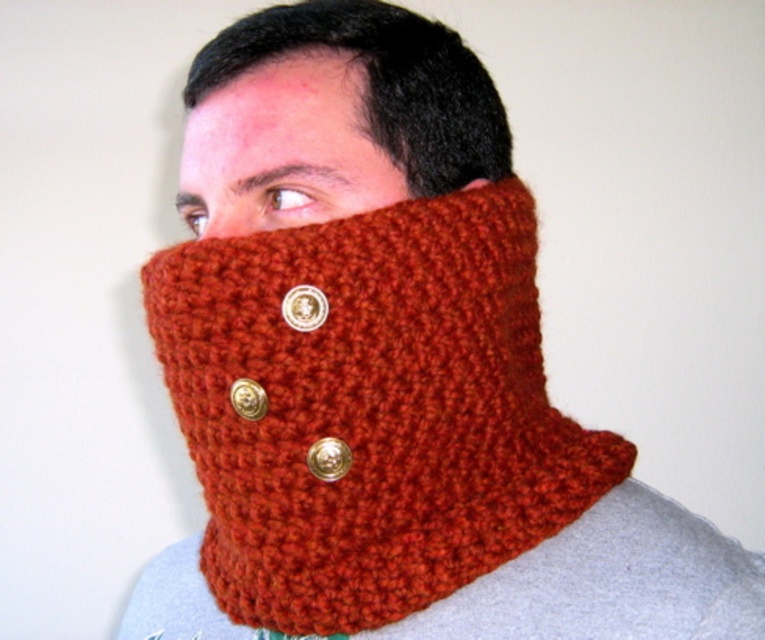
You are a fashion stylist helping a client choose between two scarves. The client is looking at the rust knitted scarf at center and the matte orange knit at center. Which one is located to the right of the other?

The rust knitted scarf at center is positioned on the right side of matte orange knit at center.

You are a fashion designer trying to create a layered look using both the rust knitted scarf at center and the orange knitted scarf at center. Which scarf should you place on top to ensure the taller one is visible?

The rust knitted scarf at center is taller than the orange knitted scarf at center, so you should place the rust knitted scarf at center on top to ensure its visibility.

You are a fashion designer trying to decide which scarf to feature in your winter collection. You have two options in front of you, a rust knitted scarf at center and an orange knitted scarf at center. Based on their widths, which one would you choose if you want a wider scarf?

The rust knitted scarf at center has a greater width than the orange knitted scarf at center, so you should choose the rust knitted scarf at center for a wider option.